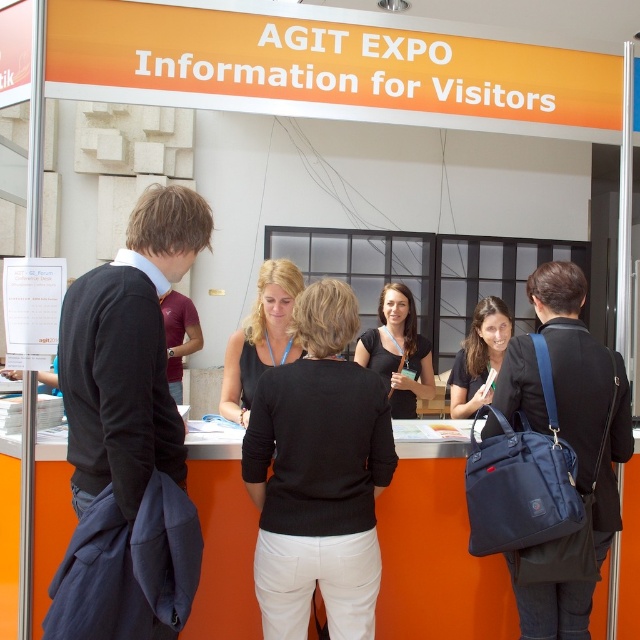
Question: Considering the real-world distances, which object is farthest from the black fabric jacket at left?

Choices:
 (A) black matte shirt at center
 (B) maroon jersey at center
 (C) matte black top at center

Answer: (B)

Question: Among these points, which one is nearest to the camera?

Choices:
 (A) (413, 323)
 (B) (120, 467)
 (C) (490, 307)

Answer: (B)

Question: Does black fabric jacket at left have a greater width compared to black matte sweater at center?

Choices:
 (A) yes
 (B) no

Answer: (B)

Question: From the image, what is the correct spatial relationship of black fabric jacket at left in relation to matte black bag at right?

Choices:
 (A) left
 (B) right

Answer: (A)

Question: Which object is positioned farthest from the matte black top at center?

Choices:
 (A) maroon jersey at center
 (B) matte black bag at right

Answer: (A)

Question: Does black matte sweater at center have a lesser width compared to matte black top at center?

Choices:
 (A) yes
 (B) no

Answer: (B)